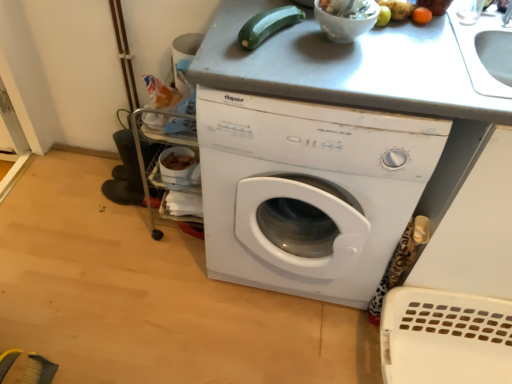
This screenshot has height=384, width=512. I want to click on vacant space in front of orange matte fruit at upper right, the 1th vegetable when ordered from right to left, so click(425, 50).